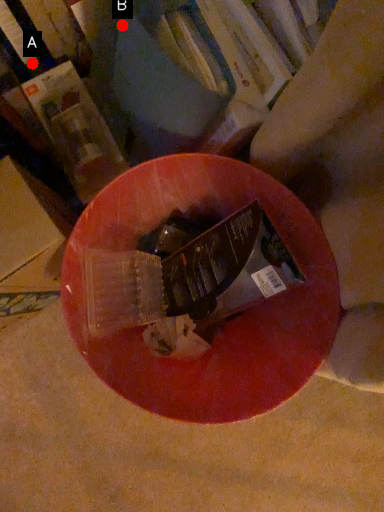
Question: Two points are circled on the image, labeled by A and B beside each circle. Which point appears farthest from the camera in this image?

Choices:
 (A) A is further
 (B) B is further

Answer: (A)